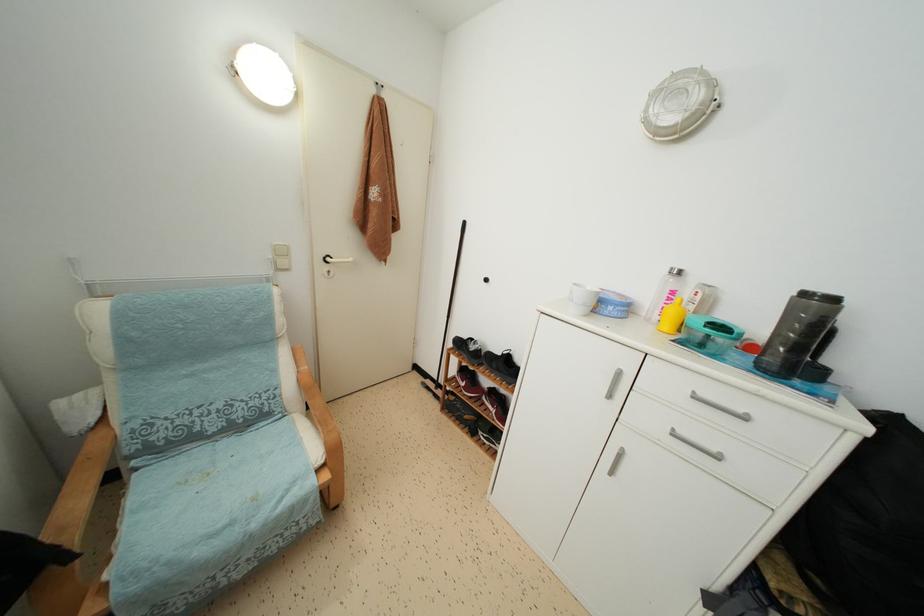
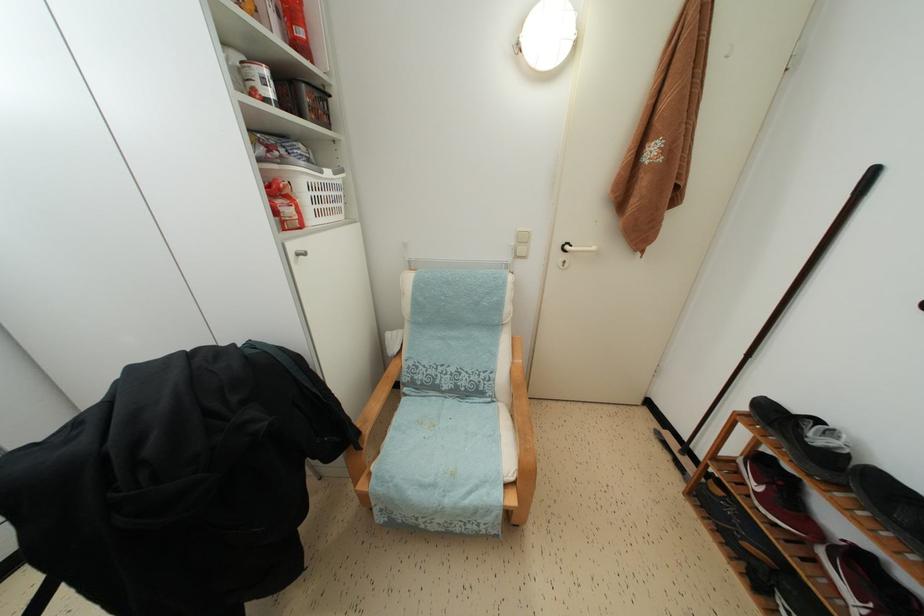
Find the pixel in the second image that matches point (304, 450) in the first image.

(502, 447)